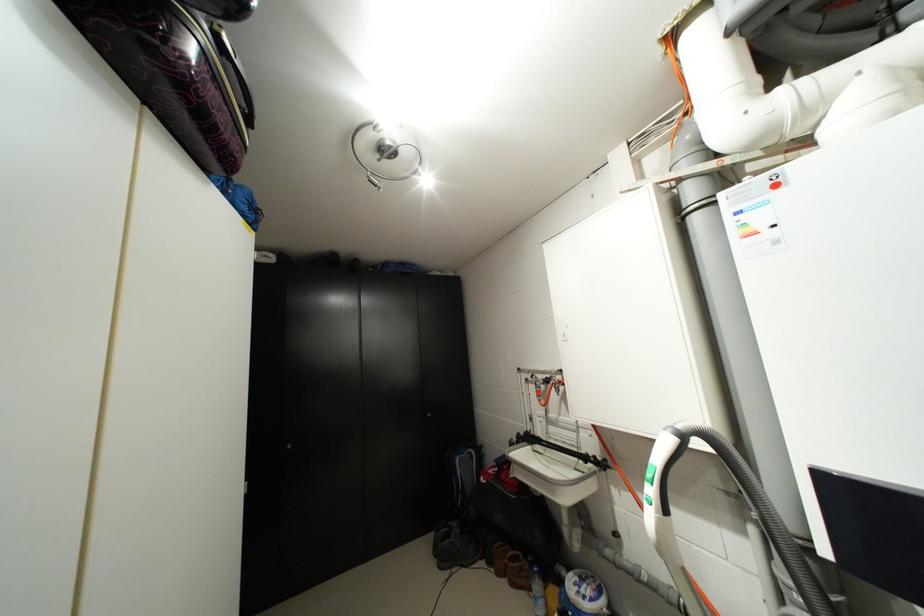
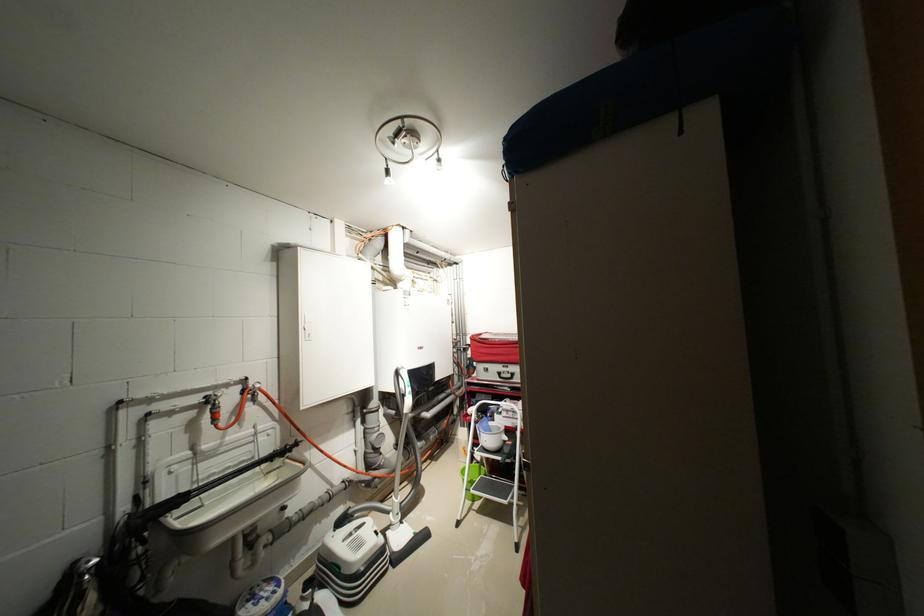
Where in the second image is the point corresponding to (x=594, y=438) from the first image?

(273, 439)